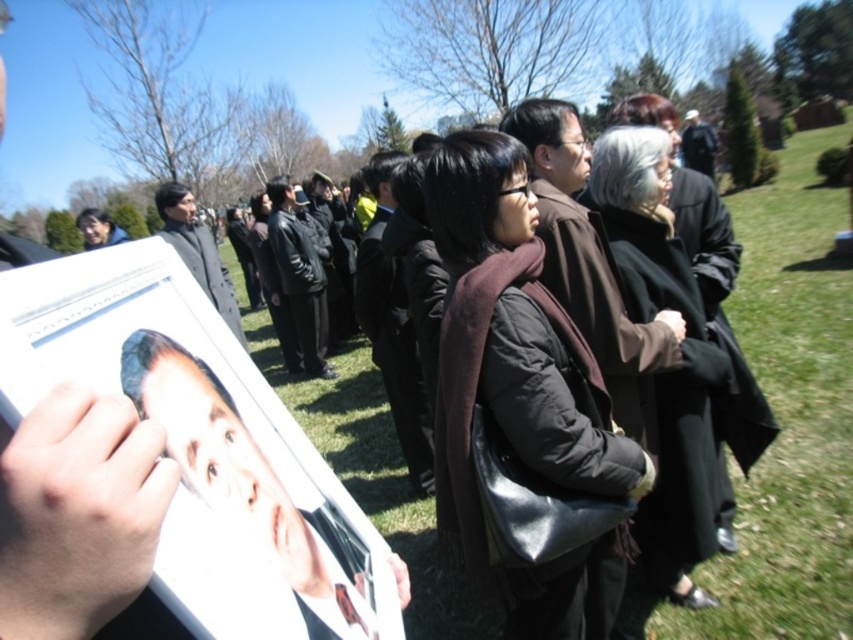
You are organizing a photo shoot and need to ensure that the dark brown wool scarf at center and the black wool coat at center are positioned exactly 60 centimeters apart. Based on the current arrangement shown in the image, do you need to move them closer or farther apart to meet this requirement?

The distance between the dark brown wool scarf at center and the black wool coat at center is currently 65.89 centimeters. To achieve the desired 60 centimeter separation, you should move them closer together by approximately 5.89 centimeters.

You are part of the group at the memorial service and need to determine if the dark brown wool scarf at center can be placed inside the black wool coat at center without folding it. Based on their heights, is this possible?

The dark brown wool scarf at center is not as tall as the black wool coat at center, so it can be placed inside without folding since the coat is taller.